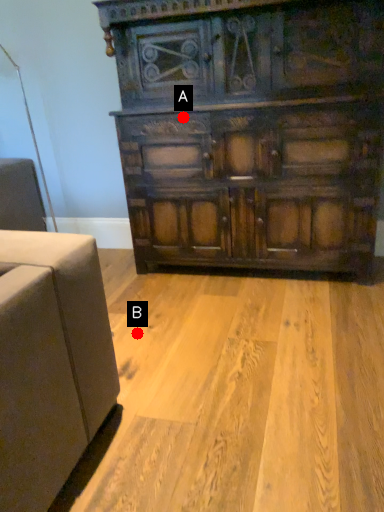
Question: Two points are circled on the image, labeled by A and B beside each circle. Which point appears farthest from the camera in this image?

Choices:
 (A) A is further
 (B) B is further

Answer: (A)